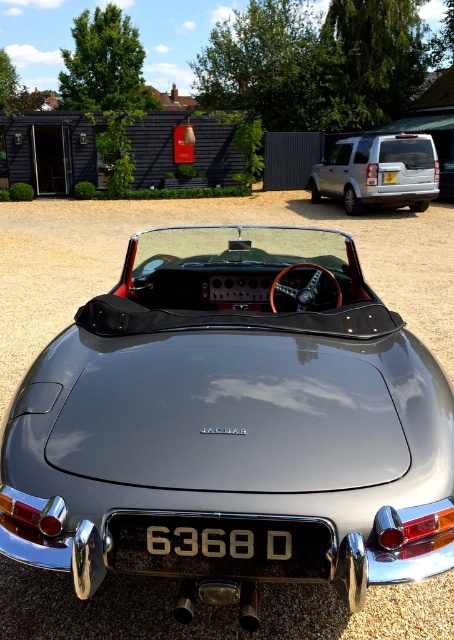
You are standing in front of the shiny metallic sports car at center and want to look at the silver metallic suv at upper right. Which direction should you turn your head to see it?

You should turn your head to the upper right to see the silver metallic suv at upper right since the shiny metallic sports car at center is below it.

You are standing at the entrance of the driveway and want to park your car near the shiny metallic sports car at center. The parking spot you choose must be within a 1 meter radius of point [232,426]. Is this possible?

The shiny metallic sports car at center is already located at point [232,426], so parking within a 1 meter radius of that point would place your car very close to it. However, since the sports car is already there, you might not have enough space unless the parking spot is directly next to it. Check the available space carefully before proceeding.

You are standing at the center of the gravel driveway where the classic Jaguar sports car is parked. You want to walk towards the silver metallic suv at upper right. Which direction should you head?

The silver metallic suv at upper right is located at point (378, 172), so you should head towards the upper right direction to reach it.